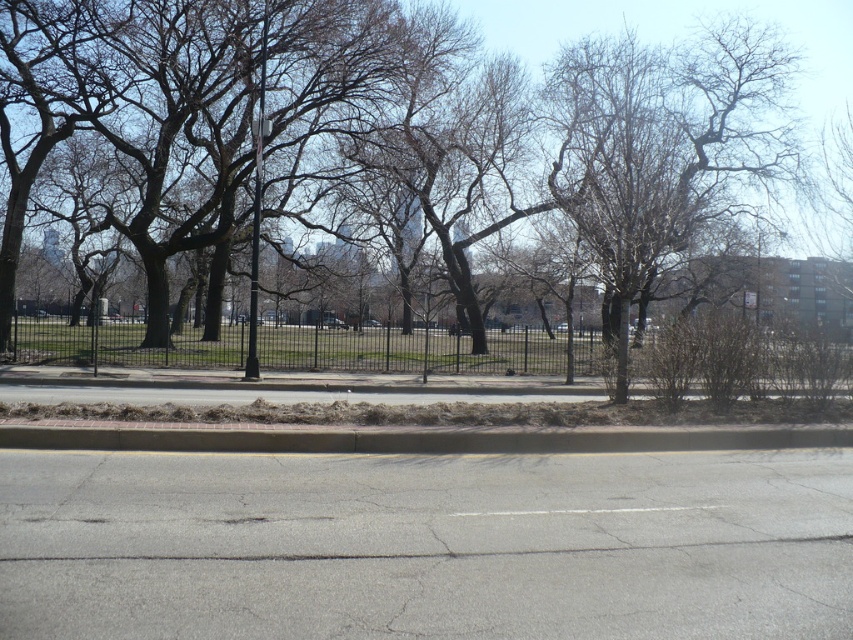
You are standing at the center of the road in the image. Looking towards the brown bark tree at left, in which direction relative to your position is the tree located?

The brown bark tree at left is located to the left side of your position based on its coordinates at point (524, 141).

You are a pedestrian standing on the paved road and want to cross to the park area. You see the bare branches at center and the white asphalt line at center. Which object is closer to the park fence?

The white asphalt line at center is closer to the park fence because the bare branches at center is positioned on the right side of it, meaning the asphalt line is between the pedestrian and the fence.